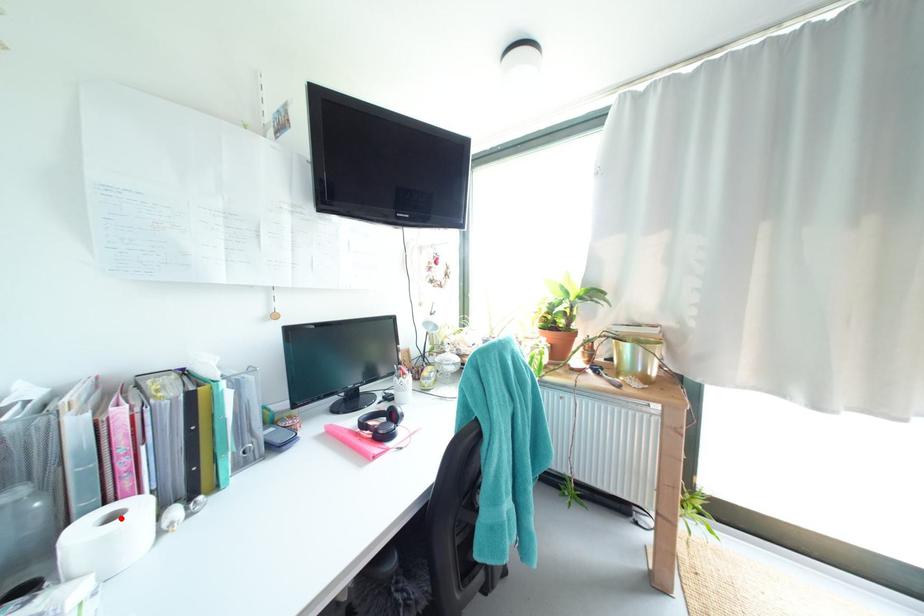
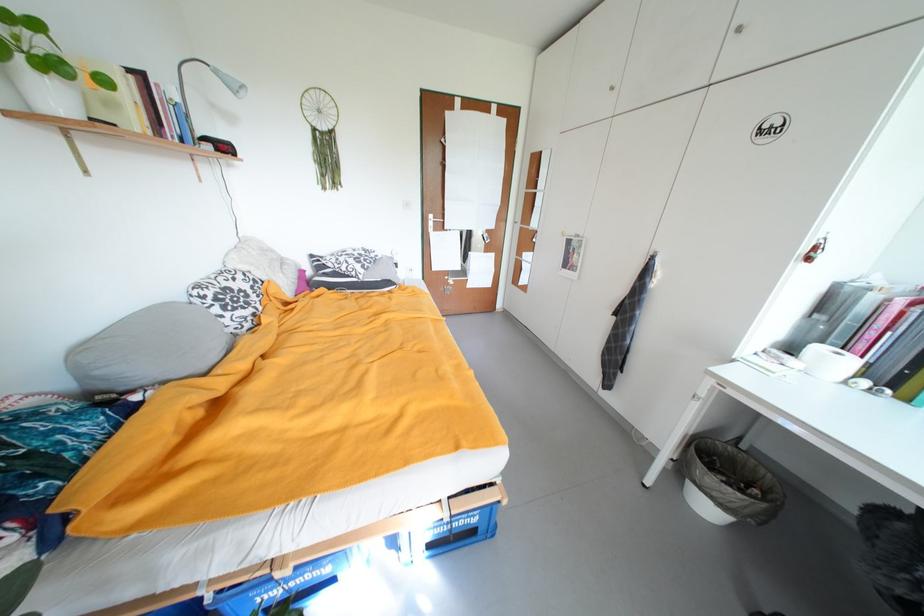
Find the pixel in the second image that matches the highlighted location in the first image.

(845, 355)